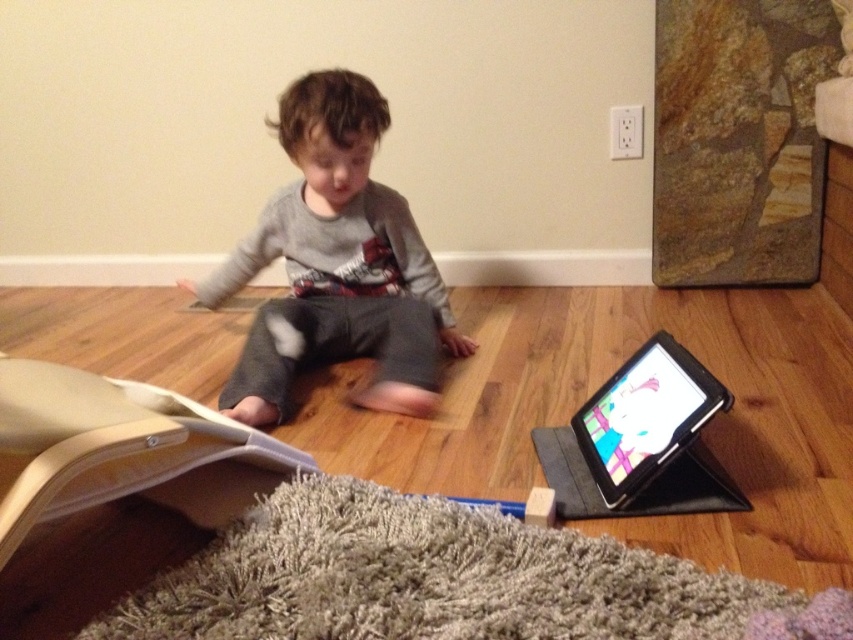
You are a parent trying to locate your child who is sitting on the floor. You see the gray cotton shirt at center and the black plastic tablet at lower right. Which object is closer to the left side of the scene?

The gray cotton shirt at center is positioned on the left side of black plastic tablet at lower right, so the gray cotton shirt at center is closer to the left side of the scene.

The child is sitting on the floor and looking at their belongings. Which object is closer to the child, the gray cotton shirt at center or the black plastic tablet at lower right?

The gray cotton shirt at center is closer to the child because the black plastic tablet at lower right is behind it.